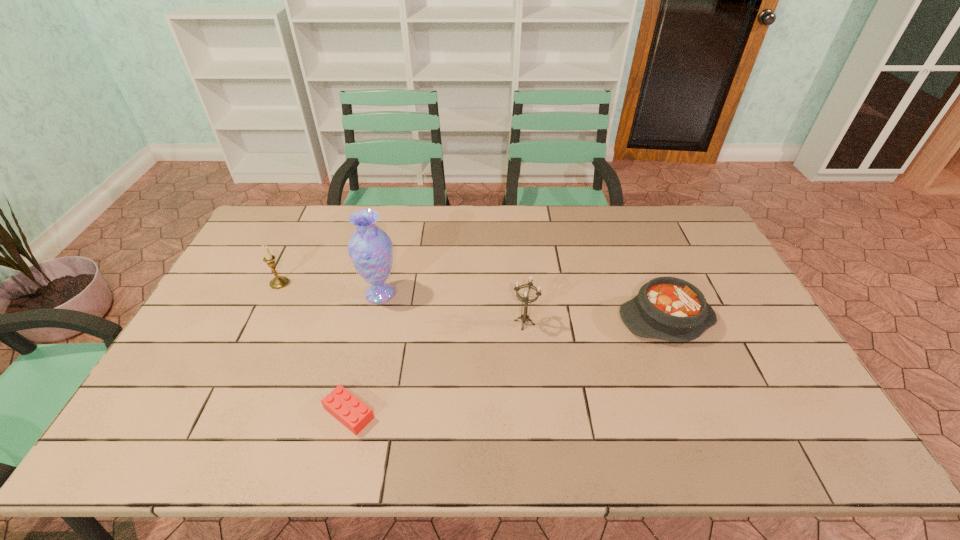
Locate an element on the screen. the tallest object is located at coordinates [x=370, y=248].

Where is `the fourth object from left to right`? the fourth object from left to right is located at coordinates (525, 299).

Where is `the nearer candle holder`? the nearer candle holder is located at coordinates [525, 299].

What are the coordinates of `the farther candle holder` in the screenshot? It's located at (278, 282).

Where is `the left candle holder`? the left candle holder is located at coordinates (278, 282).

The image size is (960, 540). I want to click on the fourth tallest object, so click(667, 308).

This screenshot has width=960, height=540. What are the coordinates of `the rightmost object` in the screenshot? It's located at (667, 308).

Where is `Lego`? This screenshot has height=540, width=960. Lego is located at coordinates (355, 415).

Identify the location of the nearest object. (355, 415).

Find the location of a particular element. vacant space positioned 0.180m on the front of the vase is located at coordinates (366, 357).